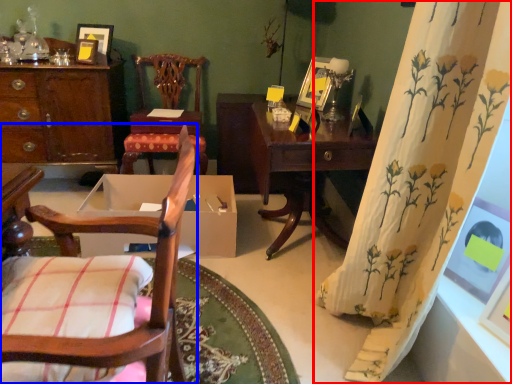
Question: Which object appears closest to the camera in this image, curtain (highlighted by a red box) or chair (highlighted by a blue box)?

Choices:
 (A) curtain
 (B) chair

Answer: (B)